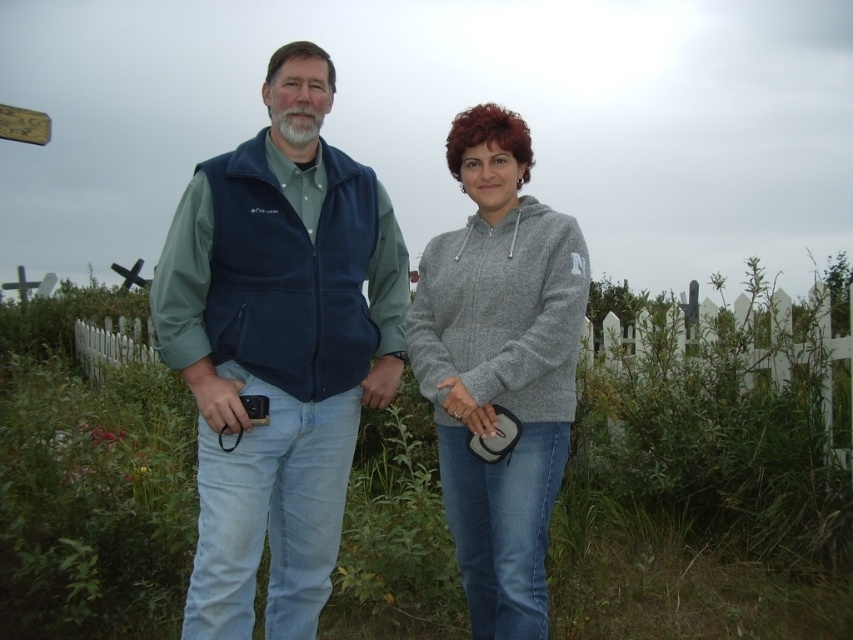
Locate an element on the screen. navy blue fleece vest at center is located at coordinates (277, 348).

Is navy blue fleece vest at center further to the viewer compared to gray fleece hoodie at center?

No, navy blue fleece vest at center is closer to the viewer.

Locate an element on the screen. navy blue fleece vest at center is located at coordinates (277, 348).